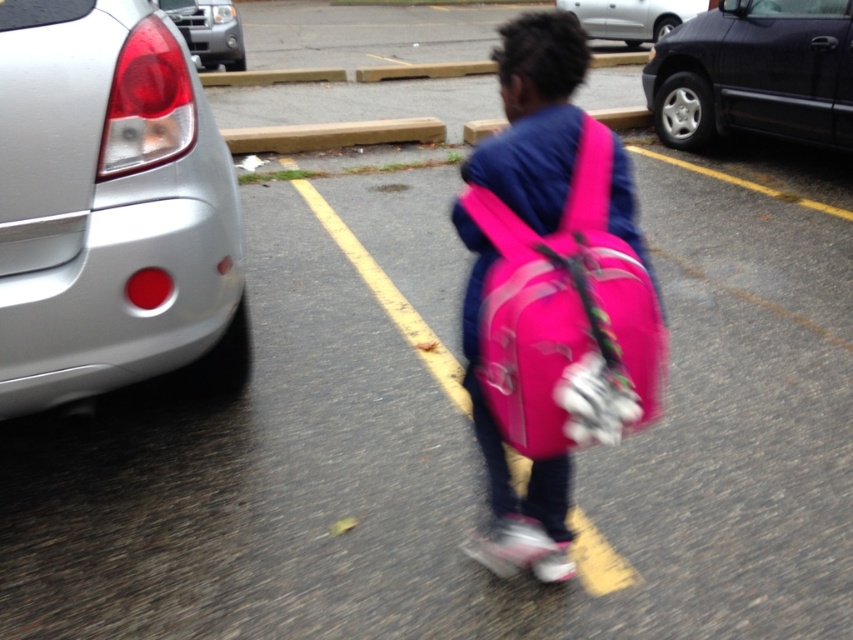
You are a delivery person trying to park your van in the parking lot. You need to know which vehicle is nearer to you so you can avoid it. Which is closer to you, the silver metallic car at left or the metallic silver truck at upper left?

The silver metallic car at left is closer to the viewer than the metallic silver truck at upper left, so you should be cautious of the silver metallic car at left when parking.

From the picture: You are standing in the parking lot and want to walk from the point at coordinates (582, 253) to the point at coordinates (625, 42). Which direction should you face to walk directly towards your destination?

You should face towards the point at coordinates (625, 42), which is further away from you than the starting point at (582, 253).